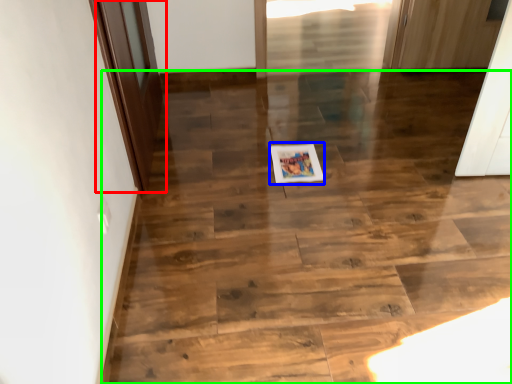
Question: Which object is the closest to the door (highlighted by a red box)? Choose among these: postcard (highlighted by a blue box) or stairwell (highlighted by a green box).

Choices:
 (A) postcard
 (B) stairwell

Answer: (B)